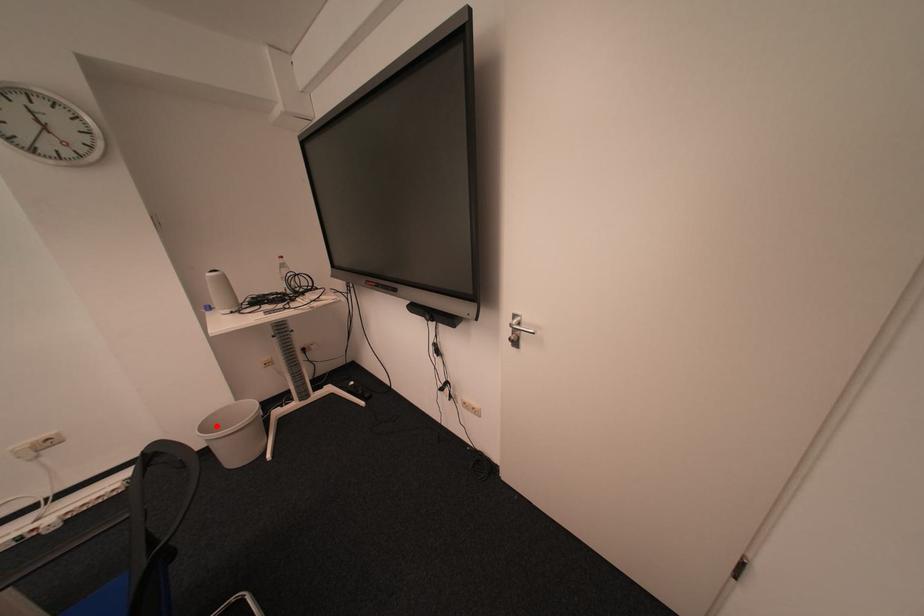
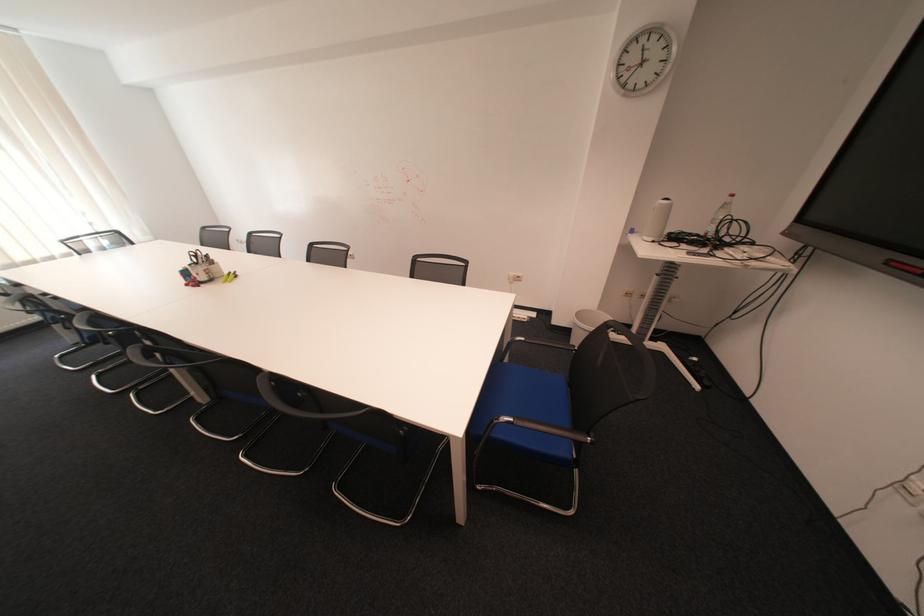
Question: I am providing you with two images of the same scene from different viewpoints. Given a red point in image1, look at the same physical point in image2. Is it:

Choices:
 (A) Closer to the viewpoint
 (B) Farther from the viewpoint

Answer: (A)